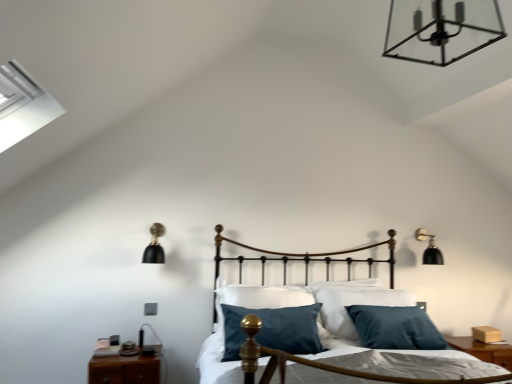
Question: Is black matte wall sconce at right, the 1th lamp in the back-to-front sequence, bigger or smaller than gold polished metal bed frame at center?

Choices:
 (A) big
 (B) small

Answer: (B)

Question: Does point (418, 240) appear closer or farther from the camera than point (337, 360)?

Choices:
 (A) farther
 (B) closer

Answer: (A)

Question: Considering the real-world distances, which object is closest to the gold polished metal bed frame at center?

Choices:
 (A) metal/transparent glass chandelier at upper center, the first lamp when ordered from top to bottom
 (B) black matte wall sconce at right, the 1th lamp in the back-to-front sequence
 (C) brown wood nightstand at lower left, the second nightstand positioned from the right
 (D) black matte wall sconce at left, marked as the third lamp in a right-to-left arrangement
 (E) brown wood nightstand at lower right, which is counted as the 1th nightstand, starting from the right

Answer: (E)

Question: Which is nearer to the black matte wall sconce at left, the second lamp when ordered from top to bottom?

Choices:
 (A) black matte wall sconce at right, positioned as the 3th lamp in left-to-right order
 (B) brown wood nightstand at lower right, which is counted as the 1th nightstand, starting from the right
 (C) metal/transparent glass chandelier at upper center, which is the 3th lamp in back-to-front order
 (D) gold polished metal bed frame at center
 (E) brown wood nightstand at lower left, the second nightstand positioned from the right

Answer: (E)